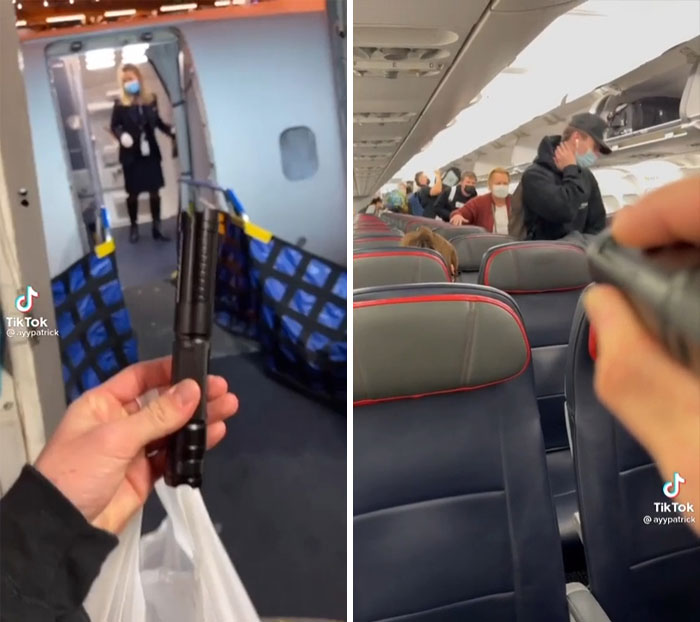
Locate an element on the screen. lights is located at coordinates (602, 43).